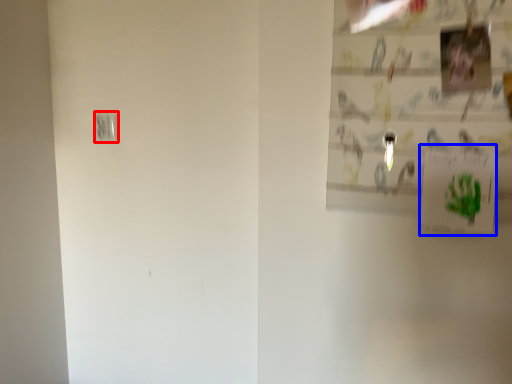
Question: Which point is further to the camera, light switch (highlighted by a red box) or postcard (highlighted by a blue box)?

Choices:
 (A) light switch
 (B) postcard

Answer: (A)